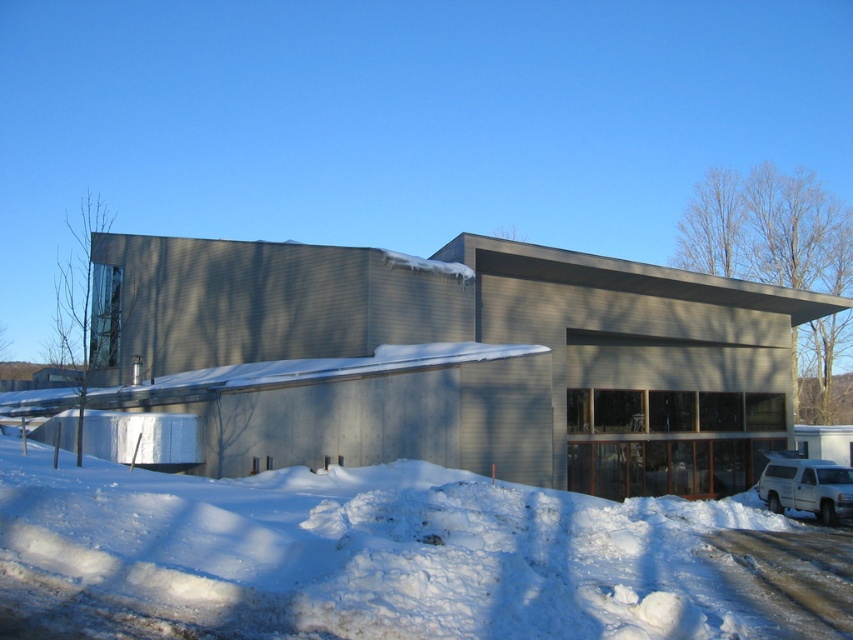
Question: Does white fluffy snow at lower center have a larger size compared to white matte suv at lower right?

Choices:
 (A) no
 (B) yes

Answer: (B)

Question: Can you confirm if white fluffy snow at lower center is positioned above white matte suv at lower right?

Choices:
 (A) yes
 (B) no

Answer: (A)

Question: Can you confirm if white fluffy snow at lower center is smaller than white matte suv at lower right?

Choices:
 (A) yes
 (B) no

Answer: (B)

Question: Which point is closer to the camera?

Choices:
 (A) (822, 484)
 (B) (131, 618)

Answer: (B)